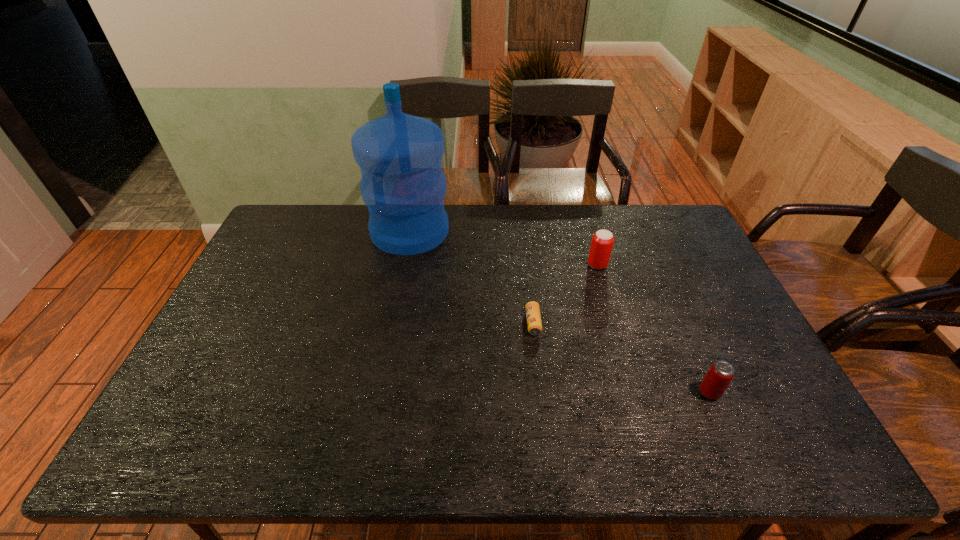
Find the location of a particular element. vacant space located 0.100m on the front of the third tallest object is located at coordinates (731, 441).

Find the location of a particular element. This screenshot has height=540, width=960. free space located 0.210m on the back of the second nearest object is located at coordinates (526, 262).

Identify the location of object at the far edge. The image size is (960, 540). (403, 185).

I want to click on object located in the right edge section of the desktop, so click(x=720, y=374).

Identify the location of free point at the far edge. (617, 234).

Identify the location of blank space at the left edge. (257, 312).

In the image, there is a desktop. At what (x,y) coordinates should I click in order to perform the action: click on free space at the right edge. Please return your answer as a coordinate pair (x, y). Looking at the image, I should click on (720, 316).

The width and height of the screenshot is (960, 540). Find the location of `vacant space at the far left corner of the desktop`. vacant space at the far left corner of the desktop is located at coordinates (281, 208).

Where is `free space at the near right corner`? The image size is (960, 540). free space at the near right corner is located at coordinates (786, 435).

Where is `vacant area between the third tallest object and the farthest object`? vacant area between the third tallest object and the farthest object is located at coordinates (560, 312).